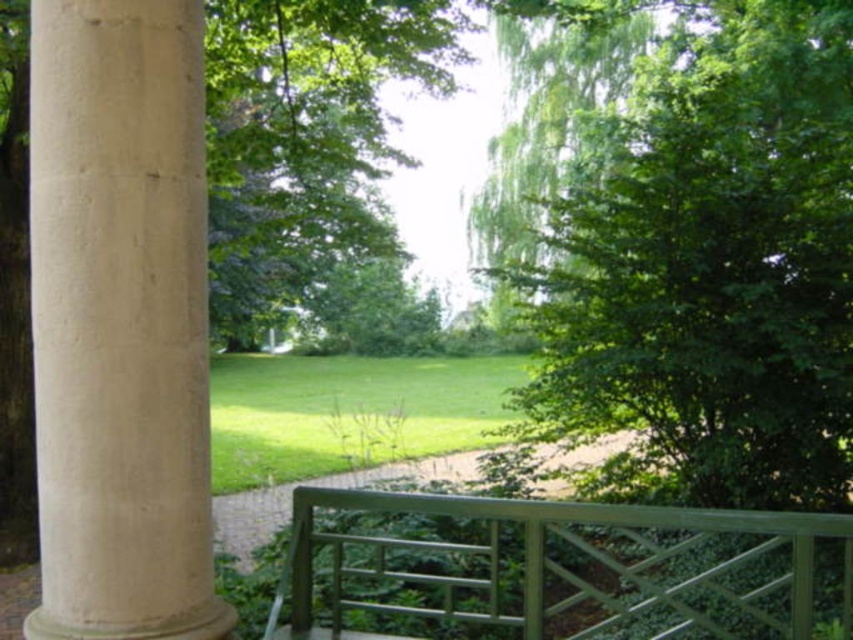
Between green leafy tree at center and beige stone column at left, which one has less height?

beige stone column at left

Is green leafy tree at center positioned before beige stone column at left?

No, green leafy tree at center is further to the viewer.

Between point (628, 216) and point (67, 141), which one is positioned behind?

Point (628, 216)

Locate an element on the screen. Image resolution: width=853 pixels, height=640 pixels. green leafy tree at center is located at coordinates (712, 260).

Does point (103, 428) come farther from viewer compared to point (589, 632)?

No, (103, 428) is closer to viewer.

Can you confirm if beige stone column at left is positioned to the right of green painted wood railing at center?

No, beige stone column at left is not to the right of green painted wood railing at center.

Image resolution: width=853 pixels, height=640 pixels. Describe the element at coordinates (120, 321) in the screenshot. I see `beige stone column at left` at that location.

At what (x,y) coordinates should I click in order to perform the action: click on beige stone column at left. Please return your answer as a coordinate pair (x, y). This screenshot has width=853, height=640. Looking at the image, I should click on (120, 321).

Does green leafy tree at center appear under green painted wood railing at center?

Actually, green leafy tree at center is above green painted wood railing at center.

Does green leafy tree at center have a lesser width compared to green painted wood railing at center?

Incorrect, green leafy tree at center's width is not less than green painted wood railing at center's.

Locate an element on the screen. The height and width of the screenshot is (640, 853). green leafy tree at center is located at coordinates (712, 260).

Find the location of a particular element. green leafy tree at center is located at coordinates (712, 260).